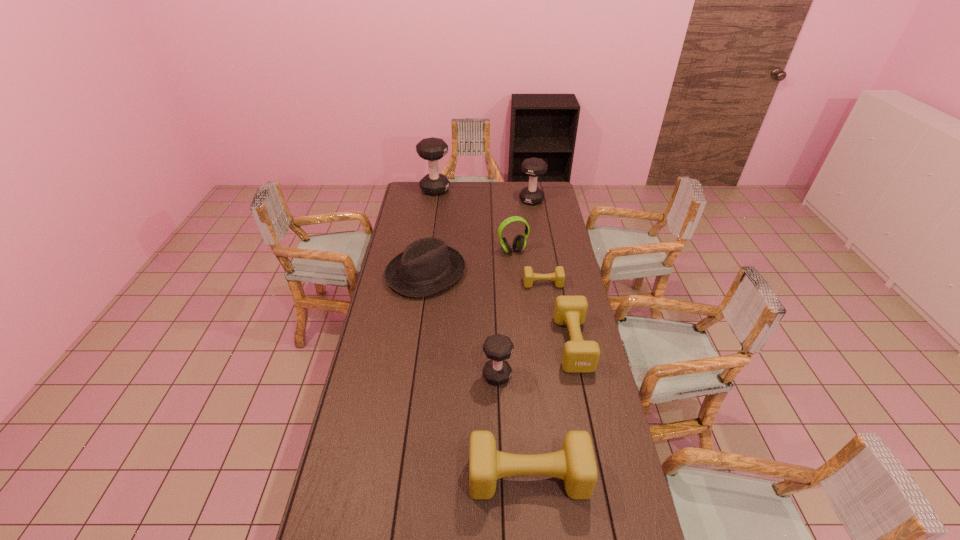
This screenshot has height=540, width=960. Find the location of `vacant space situated 0.100m on the left of the second biggest olive dumbbell`. vacant space situated 0.100m on the left of the second biggest olive dumbbell is located at coordinates (532, 343).

This screenshot has height=540, width=960. I want to click on free space located on the left of the shortest dumbbell, so click(x=504, y=284).

You are a GUI agent. You are given a task and a screenshot of the screen. Output one action in this format:
    pyautogui.click(x=<x>, y=<y>)
    Task: Click on the dumbbell that is at the left edge
    This screenshot has height=540, width=960.
    Given the screenshot: What is the action you would take?
    pyautogui.click(x=432, y=149)

Find the location of a particular element. The height and width of the screenshot is (540, 960). fedora at the left edge is located at coordinates (427, 266).

Image resolution: width=960 pixels, height=540 pixels. Identify the location of object at the far left corner. (432, 149).

I want to click on object present at the far right corner, so pos(533,167).

Where is `free space at the far edge`? free space at the far edge is located at coordinates (477, 195).

Identify the location of vacant position at the left edge of the desktop. (423, 224).

Locate an element on the screen. Image resolution: width=960 pixels, height=540 pixels. vacant space at the right edge is located at coordinates (555, 206).

Locate an element on the screen. The image size is (960, 540). vacant region at the far left corner of the desktop is located at coordinates (416, 193).